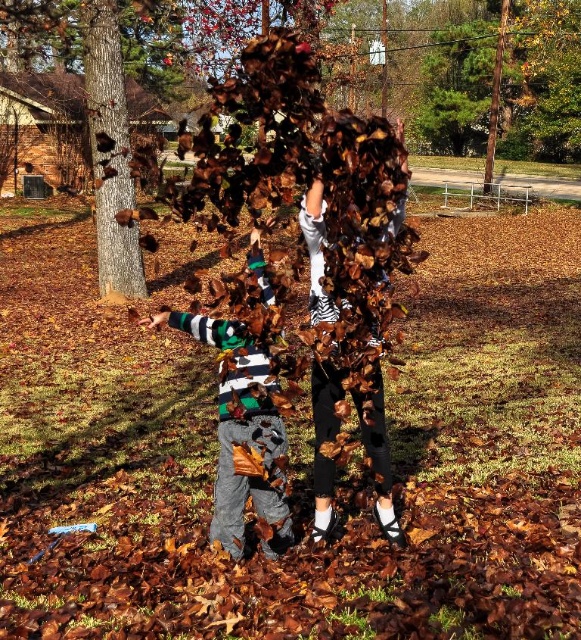
Is striped cotton shirt at left closer to camera compared to smooth brown bark at left?

No, striped cotton shirt at left is behind smooth brown bark at left.

Measure the distance between point (245, 417) and camera.

Point (245, 417) and camera are 4.86 meters apart.

Find the location of a particular element. The height and width of the screenshot is (640, 581). striped cotton shirt at left is located at coordinates (239, 435).